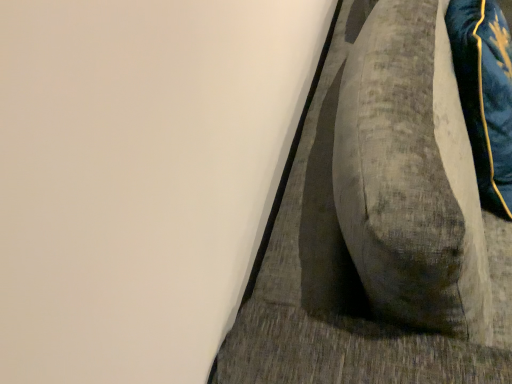
Image resolution: width=512 pixels, height=384 pixels. I want to click on textured gray bean bag at right, so click(x=378, y=223).

Describe the element at coordinates (378, 223) in the screenshot. I see `textured gray bean bag at right` at that location.

Where is `textured gray bean bag at right`? Image resolution: width=512 pixels, height=384 pixels. textured gray bean bag at right is located at coordinates (378, 223).